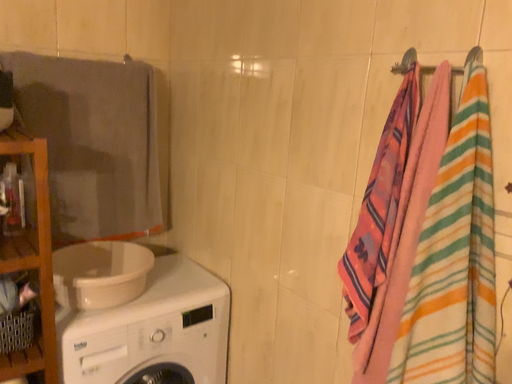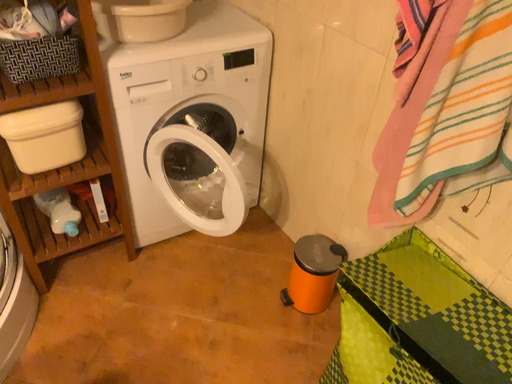
Question: Which way did the camera rotate in the video?

Choices:
 (A) rotated upward
 (B) rotated downward

Answer: (B)